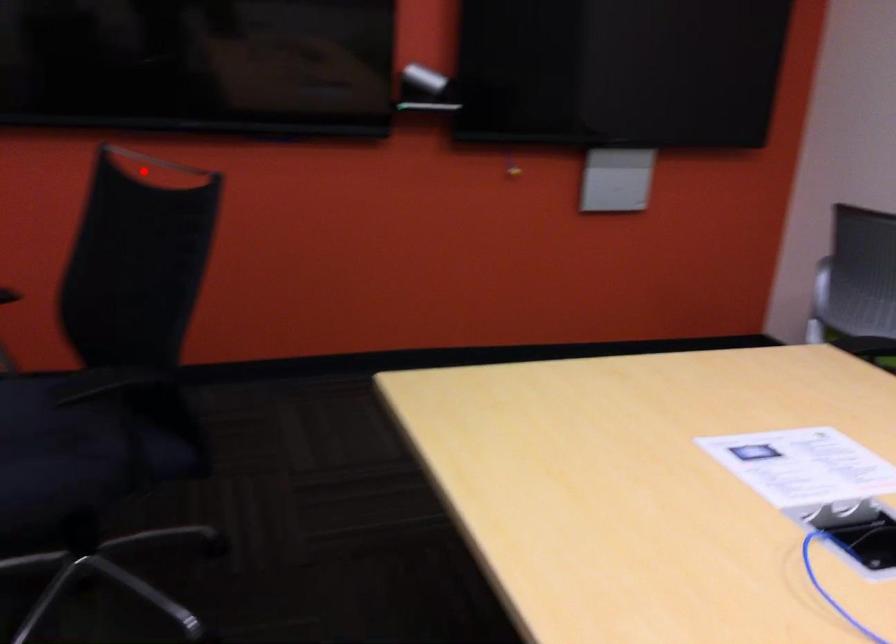
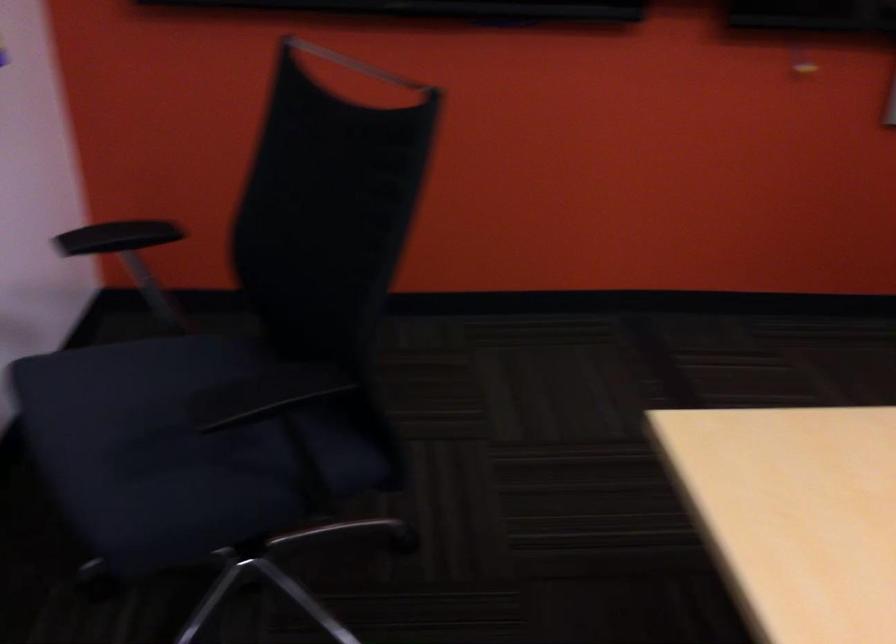
Question: I am providing you with two images of the same scene from different viewpoints. A red point is shown in image1. For the corresponding object point in image2, is it positioned nearer or farther from the camera?

Choices:
 (A) Nearer
 (B) Farther

Answer: (A)